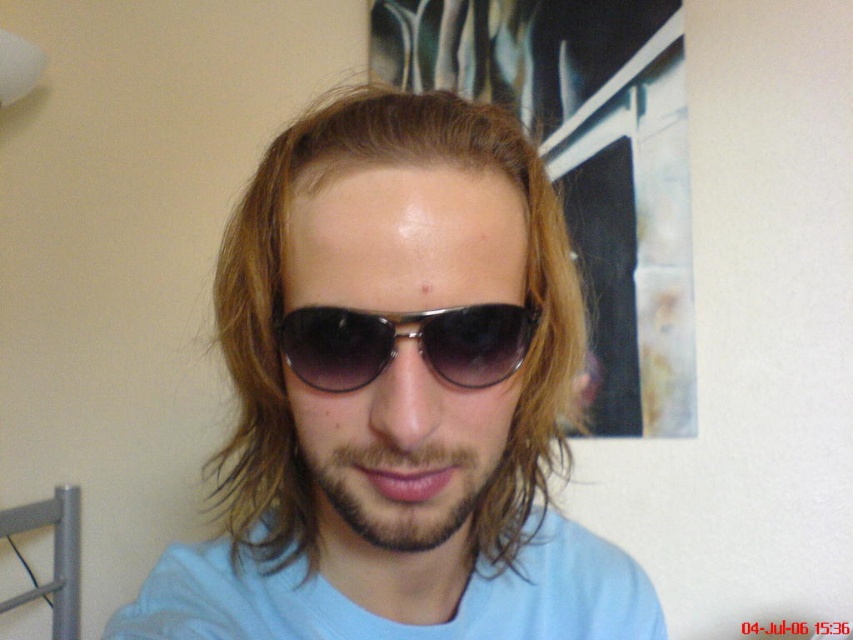
Can you confirm if brown matte hair at center is smaller than light blue cotton shirt at center?

Incorrect, brown matte hair at center is not smaller in size than light blue cotton shirt at center.

Who is more distant from viewer, (x=252, y=310) or (x=236, y=627)?

Point (x=236, y=627)

Where is `brown matte hair at center`? This screenshot has height=640, width=853. brown matte hair at center is located at coordinates (287, 301).

Can you confirm if light blue cotton shirt at center is positioned to the right of black metallic sunglasses at center?

Indeed, light blue cotton shirt at center is positioned on the right side of black metallic sunglasses at center.

Which is in front, point (126, 621) or point (297, 369)?

Point (297, 369) is in front.

Image resolution: width=853 pixels, height=640 pixels. What do you see at coordinates (389, 620) in the screenshot?
I see `light blue cotton shirt at center` at bounding box center [389, 620].

The height and width of the screenshot is (640, 853). I want to click on light blue cotton shirt at center, so click(389, 620).

Who is more distant from viewer, (x=263, y=524) or (x=399, y=518)?

The point (x=263, y=524) is behind.

Who is shorter, brown matte hair at center or dark brown stubble at center?

Standing shorter between the two is dark brown stubble at center.

This screenshot has width=853, height=640. What do you see at coordinates (287, 301) in the screenshot?
I see `brown matte hair at center` at bounding box center [287, 301].

The width and height of the screenshot is (853, 640). Find the location of `brown matte hair at center`. brown matte hair at center is located at coordinates (287, 301).